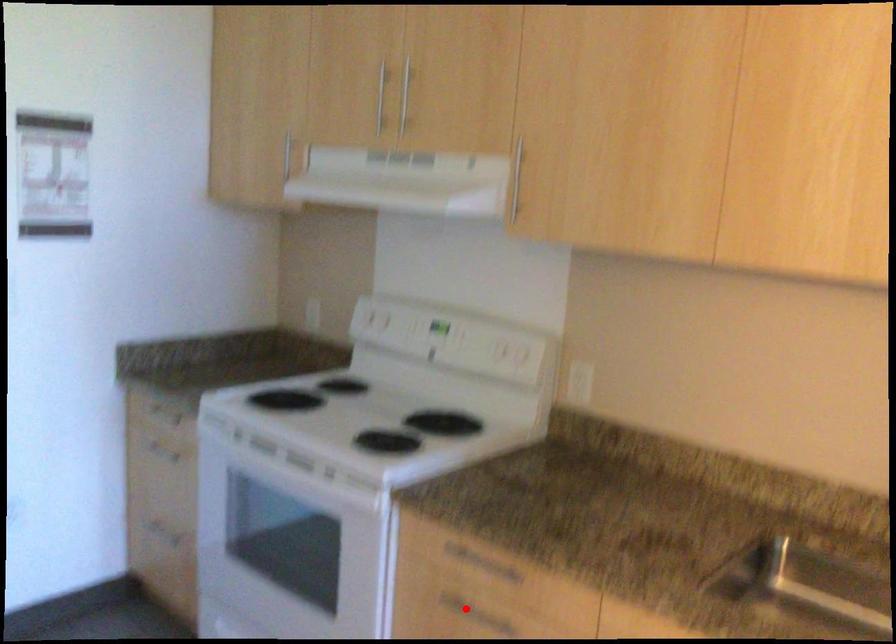
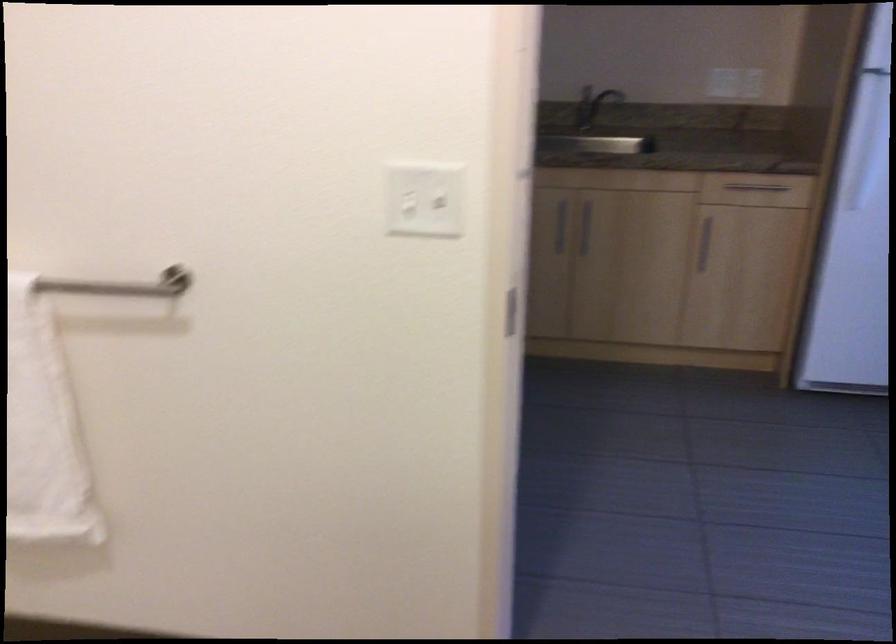
Question: I am providing you with two images of the same scene from different viewpoints. A red point is marked on the first image. Can you still see the location of the red point in image 2?

Choices:
 (A) Yes
 (B) No

Answer: (B)